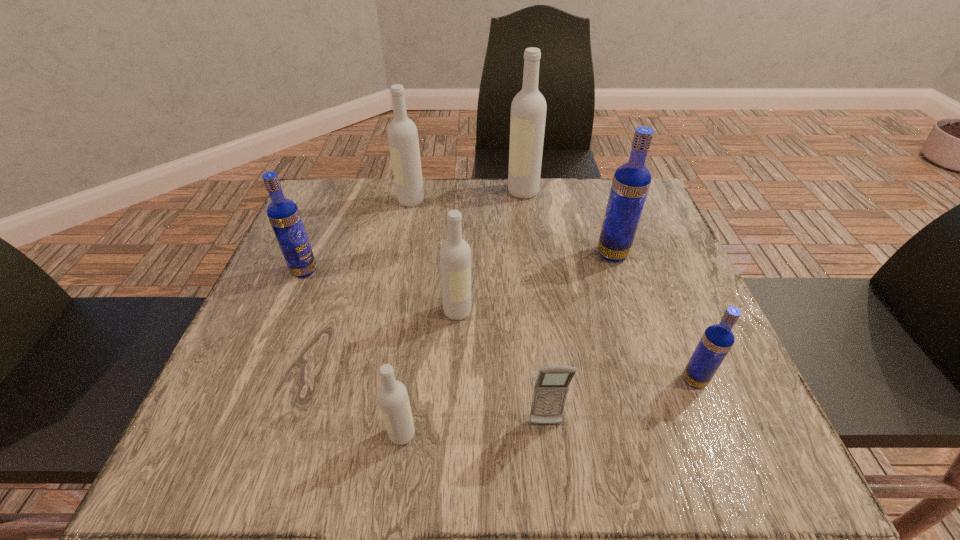
Identify the location of free space at the far left corner of the desktop. Image resolution: width=960 pixels, height=540 pixels. click(x=336, y=187).

The image size is (960, 540). I want to click on free region at the near right corner, so click(x=703, y=462).

Where is `vacant point located between the leftmost object and the second biggest white vodka`? vacant point located between the leftmost object and the second biggest white vodka is located at coordinates (358, 236).

Locate an element on the screen. free space between the tallest vodka and the leftmost white vodka is located at coordinates (467, 196).

Identify the location of free spot between the leftmost object and the rightmost white vodka. (414, 231).

You are a GUI agent. You are given a task and a screenshot of the screen. Output one action in this format:
    pyautogui.click(x=<x>, y=<y>)
    Task: Click on the empty location between the cellular telephone and the sixth farthest vodka
    Image resolution: width=960 pixels, height=540 pixels.
    Given the screenshot: What is the action you would take?
    pyautogui.click(x=620, y=402)

You are a GUI agent. You are given a task and a screenshot of the screen. Output one action in this format:
    pyautogui.click(x=<x>, y=<y>)
    Task: Click on the blank region between the third white vodka from left to right and the second blue vodka from right to left
    The image size is (960, 540).
    Given the screenshot: What is the action you would take?
    (x=535, y=282)

Locate an element on the screen. Image resolution: width=960 pixels, height=540 pixels. free space that is in between the biggest white vodka and the second object from left to right is located at coordinates (467, 196).

The image size is (960, 540). I want to click on blank region between the second blue vodka from right to left and the second white vodka from left to right, so click(x=507, y=344).

Where is `empty location between the cellular telephone and the second object from right to left`? This screenshot has width=960, height=540. empty location between the cellular telephone and the second object from right to left is located at coordinates (579, 339).